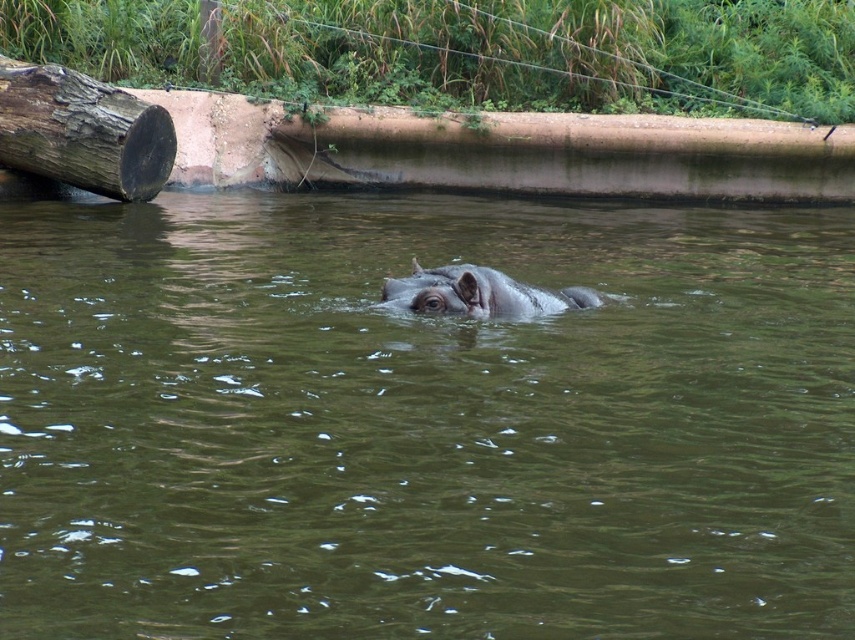
Is brown murky water at center bigger than gray matte hippo at center?

Yes.

Can you confirm if brown murky water at center is positioned below gray matte hippo at center?

No, brown murky water at center is not below gray matte hippo at center.

Image resolution: width=855 pixels, height=640 pixels. What are the coordinates of `brown murky water at center` in the screenshot? It's located at (422, 422).

Is dark brown rough log at left above gray matte hippo at center?

Yes.

Measure the distance between point [128,164] and camera.

The distance of point [128,164] from camera is 45.14 feet.

Image resolution: width=855 pixels, height=640 pixels. I want to click on dark brown rough log at left, so click(81, 131).

What are the coordinates of `dark brown rough log at left` in the screenshot? It's located at (81, 131).

Does brown murky water at center have a lesser width compared to dark brown rough log at left?

Incorrect, brown murky water at center's width is not less than dark brown rough log at left's.

Between brown murky water at center and dark brown rough log at left, which one has less height?

With less height is dark brown rough log at left.

Who is more forward, (239, 362) or (21, 77)?

Point (239, 362) is in front.

Where is `brown murky water at center`? The width and height of the screenshot is (855, 640). brown murky water at center is located at coordinates (422, 422).